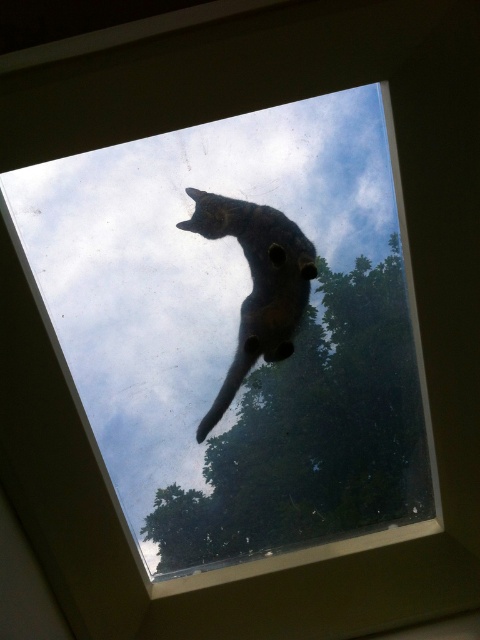
You are an architect designing a new building and want to ensure the window allows a clear view of both the green leafy tree at upper center and the shiny black cat at upper center. Given their sizes, which object would require a wider window pane to accommodate its width?

The green leafy tree at upper center requires a wider window pane because its width is larger than that of the shiny black cat at upper center.

Looking at this image, you are an observer inside the building looking through the window. You notice both the green leafy tree at upper center and the shiny black cat at upper center. Which object appears bigger in the window frame?

The green leafy tree at upper center appears bigger than the shiny black cat at upper center in the window frame because it is larger in size according to the description.